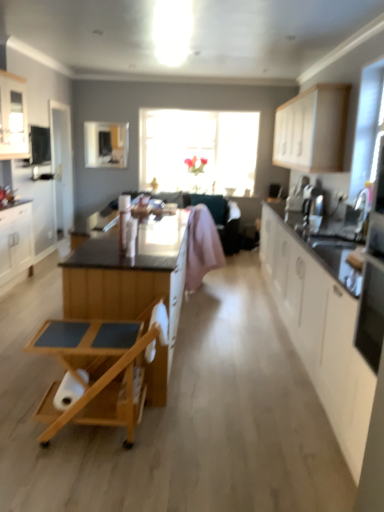
Question: Is white glossy cabinet at upper left, the 4th cabinetry in the right-to-left sequence, inside or outside of pink fabric armchair at center?

Choices:
 (A) inside
 (B) outside

Answer: (B)

Question: Is white glossy cabinet at upper left, the 4th cabinetry in the right-to-left sequence, to the left or to the right of pink fabric armchair at center in the image?

Choices:
 (A) left
 (B) right

Answer: (A)

Question: Estimate the real-world distances between objects in this image. Which object is farther from the transparent glass window at center?

Choices:
 (A) pink fabric armchair at center
 (B) white glossy cabinet at upper left, which is counted as the second cabinetry, starting from the left
 (C) white matte cabinet at right, which is the 4th cabinetry in left-to-right order
 (D) white matte cabinet at upper right, placed as the first cabinetry when sorted from right to left
 (E) wooden rolling cart at center

Answer: (E)

Question: Estimate the real-world distances between objects in this image. Which object is farther from the white glossy cabinet at upper left, the 4th cabinetry in the right-to-left sequence?

Choices:
 (A) wooden rolling cart at center
 (B) white matte cabinet at upper right, the 5th cabinetry positioned from the left
 (C) white matte cabinet at right, the 2th cabinetry positioned from the right
 (D) white glossy cabinet at left, the 5th cabinetry in the right-to-left sequence
 (E) wooden cart at center, arranged as the third cabinetry when viewed from the right

Answer: (C)